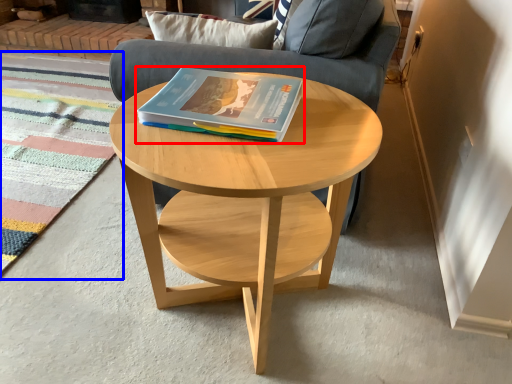
Question: Which object appears farthest to the camera in this image, book (highlighted by a red box) or mat (highlighted by a blue box)?

Choices:
 (A) book
 (B) mat

Answer: (B)